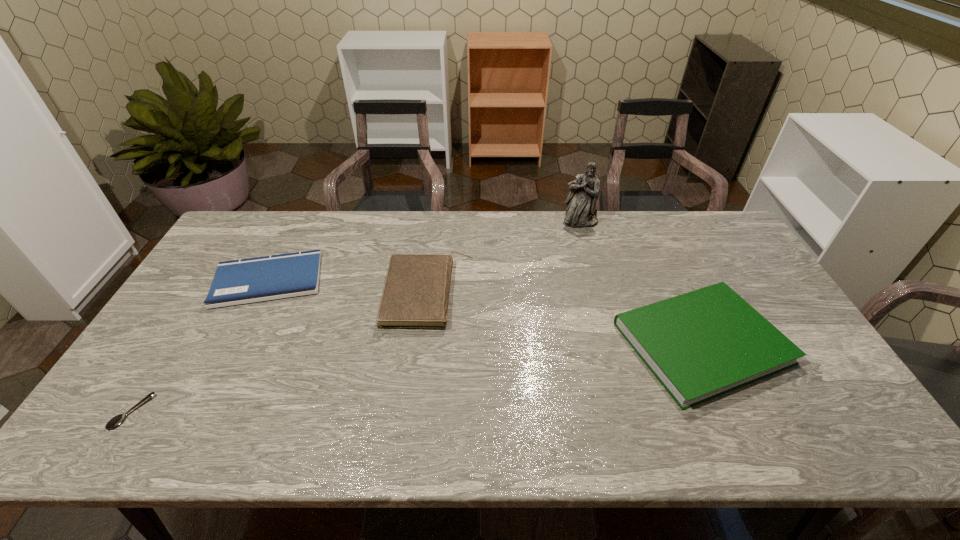
Where is `figurine`? This screenshot has width=960, height=540. figurine is located at coordinates click(x=584, y=190).

At what (x,y) coordinates should I click in order to perform the action: click on the tallest object. Please return your answer as a coordinate pair (x, y). This screenshot has height=540, width=960. Looking at the image, I should click on (584, 190).

Image resolution: width=960 pixels, height=540 pixels. Identify the location of the third object from left to right. (416, 292).

You are a GUI agent. You are given a task and a screenshot of the screen. Output one action in this format:
    pyautogui.click(x=<x>, y=<y>)
    Task: Click on the rightmost paperback book
    The image size is (960, 540).
    Given the screenshot: What is the action you would take?
    pyautogui.click(x=702, y=344)

Identify the location of the leftmost paperback book. The image size is (960, 540). (242, 281).

Image resolution: width=960 pixels, height=540 pixels. What are the coordinates of `the fourth tallest object` in the screenshot? It's located at (242, 281).

I want to click on the shortest object, so [115, 421].

You are a GUI agent. You are given a task and a screenshot of the screen. Output one action in this format:
    pyautogui.click(x=<x>, y=<y>)
    Task: Click on the free space located on the front-facing side of the figurine
    The image size is (960, 540).
    Given the screenshot: What is the action you would take?
    pyautogui.click(x=594, y=272)

I want to click on vacant space located on the spine side of the second paperback book from right to left, so click(525, 293).

Find the location of `free space located on the back of the rightmost paperback book`. free space located on the back of the rightmost paperback book is located at coordinates (643, 216).